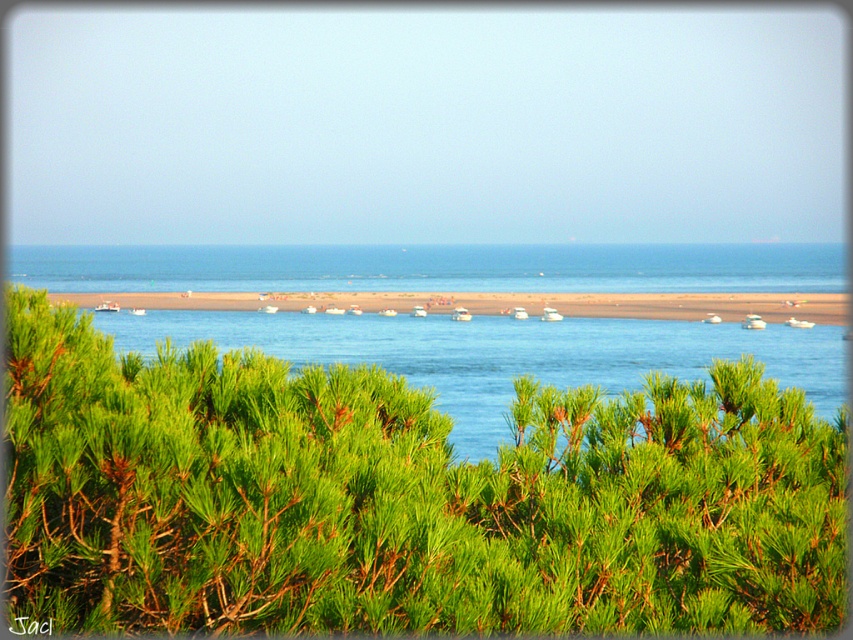
Is blue water at center in front of brown sand at center?

Yes, it is in front of brown sand at center.

Who is higher up, blue water at center or brown sand at center?

brown sand at center is higher up.

Is point (485, 364) in front of point (305, 301)?

Yes.

Image resolution: width=853 pixels, height=640 pixels. Find the location of `blue water at center`. blue water at center is located at coordinates (511, 352).

Can you confirm if green leafy bush at center is bigger than blue water at center?

Incorrect, green leafy bush at center is not larger than blue water at center.

Can you confirm if green leafy bush at center is shorter than blue water at center?

Correct, green leafy bush at center is not as tall as blue water at center.

At what (x,y) coordinates should I click in order to perform the action: click on green leafy bush at center. Please return your answer as a coordinate pair (x, y). Looking at the image, I should click on (402, 499).

Does green leafy bush at center have a lesser height compared to brown sand at center?

Yes, green leafy bush at center is shorter than brown sand at center.

Who is more forward, (49, 317) or (177, 298)?

Positioned in front is point (49, 317).

The height and width of the screenshot is (640, 853). What do you see at coordinates (402, 499) in the screenshot? I see `green leafy bush at center` at bounding box center [402, 499].

Identify the location of green leafy bush at center. The width and height of the screenshot is (853, 640). (402, 499).